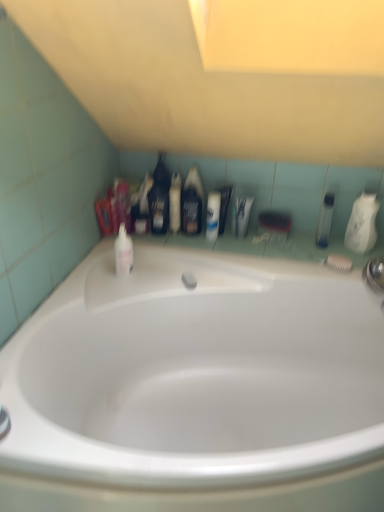
Question: Considering the relative sizes of black matte bottle at center, which ranks as the 3th mouthwash in right-to-left order, and black plastic bottle at center, the 3th toiletry viewed from the right, in the image provided, is black matte bottle at center, which ranks as the 3th mouthwash in right-to-left order, thinner than black plastic bottle at center, the 3th toiletry viewed from the right,?

Choices:
 (A) no
 (B) yes

Answer: (B)

Question: Are black matte bottle at center, positioned as the third mouthwash in left-to-right order, and black plastic bottle at center, the 3th toiletry viewed from the right, located far from each other?

Choices:
 (A) yes
 (B) no

Answer: (B)

Question: Is black matte bottle at center, positioned as the third mouthwash in left-to-right order, positioned in front of black plastic bottle at center, the 3th toiletry viewed from the right?

Choices:
 (A) no
 (B) yes

Answer: (B)

Question: Does black matte bottle at center, positioned as the third mouthwash in left-to-right order, appear on the left side of black plastic bottle at center, the 3th toiletry viewed from the right?

Choices:
 (A) no
 (B) yes

Answer: (A)

Question: Is black plastic bottle at center, the 3th toiletry viewed from the right, located within black matte bottle at center, which ranks as the 3th mouthwash in right-to-left order?

Choices:
 (A) yes
 (B) no

Answer: (B)

Question: Does black matte bottle at center, positioned as the third mouthwash in left-to-right order, lie behind black plastic bottle at center, which is the 1th toiletry from left to right?

Choices:
 (A) no
 (B) yes

Answer: (A)

Question: Is white glossy bathtub at center to the right of white glossy toothpaste tube at center, which is the 3th toiletry in left-to-right order, from the viewer's perspective?

Choices:
 (A) no
 (B) yes

Answer: (A)

Question: Is white glossy bathtub at center further to the viewer compared to white glossy toothpaste tube at center, the 1th toiletry from the right?

Choices:
 (A) yes
 (B) no

Answer: (B)

Question: Is white glossy bathtub at center not within white glossy toothpaste tube at center, which is the 3th toiletry in left-to-right order?

Choices:
 (A) yes
 (B) no

Answer: (A)

Question: Are white glossy bathtub at center and white glossy toothpaste tube at center, the 1th toiletry from the right, beside each other?

Choices:
 (A) yes
 (B) no

Answer: (B)

Question: Does white glossy bathtub at center lie in front of white glossy toothpaste tube at center, the 1th toiletry from the right?

Choices:
 (A) no
 (B) yes

Answer: (B)

Question: From the image's perspective, is white glossy bathtub at center located beneath white glossy toothpaste tube at center, which is the 3th toiletry in left-to-right order?

Choices:
 (A) yes
 (B) no

Answer: (A)

Question: Is pink glossy mouthwash at upper left, acting as the fifth mouthwash starting from the right, located outside translucent plastic mouthwash at upper center, which ranks as the fourth mouthwash in right-to-left order?

Choices:
 (A) no
 (B) yes

Answer: (B)